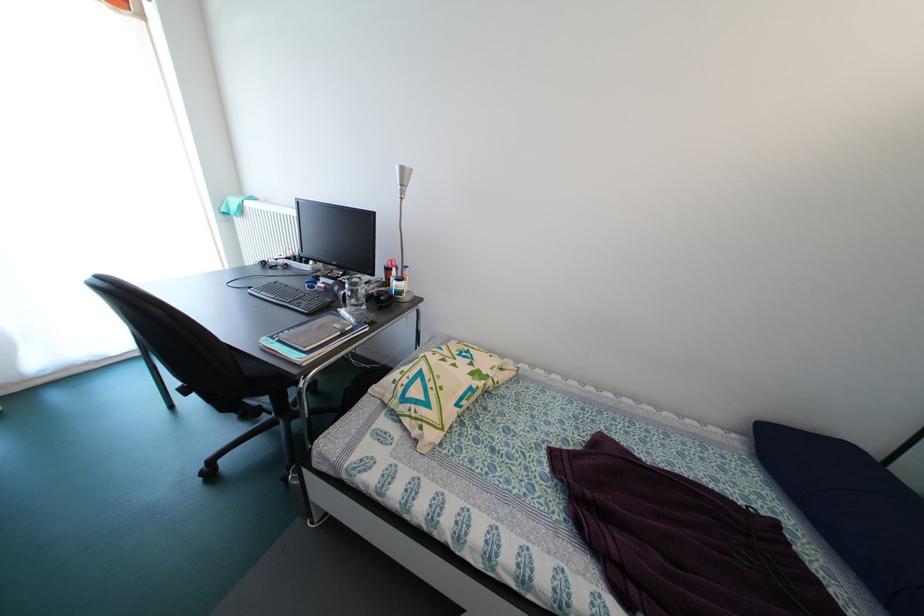
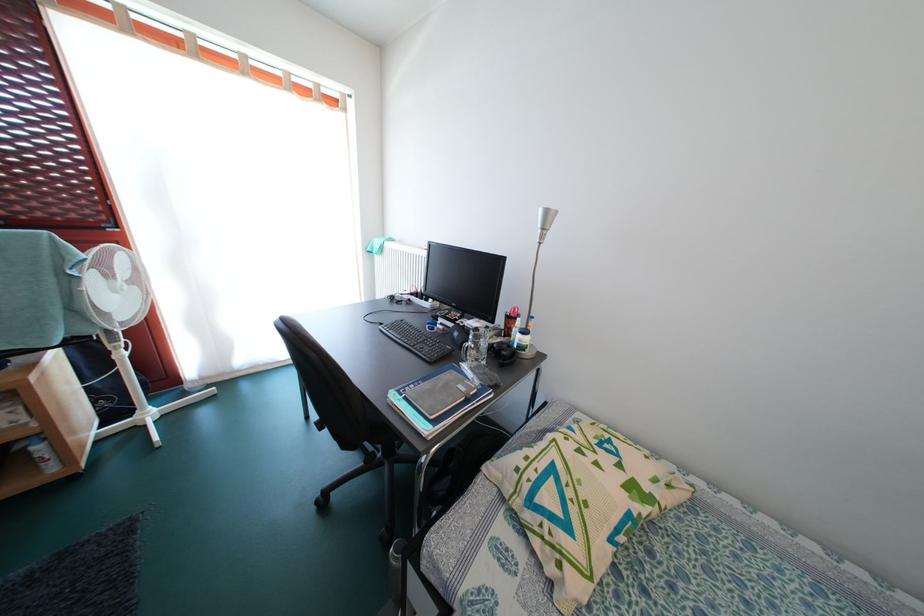
Question: How did the camera likely rotate?

Choices:
 (A) Left
 (B) Right
 (C) Up
 (D) Down

Answer: (A)